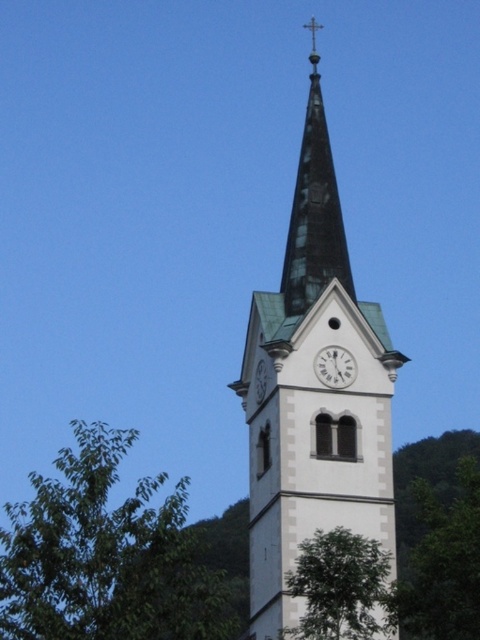
You are standing in front of the church tower and notice two points marked on the tower. The first point is at coordinates point (312, 19) and the second is at point (255, 388). Which point is closer to you?

Point (312, 19) is closer to you because it is further to the viewer than point (255, 388).